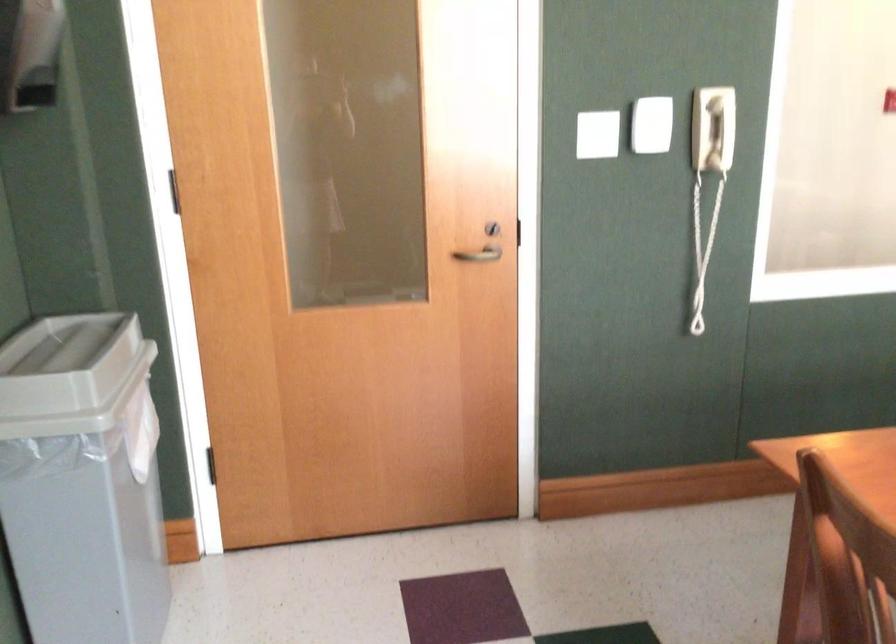
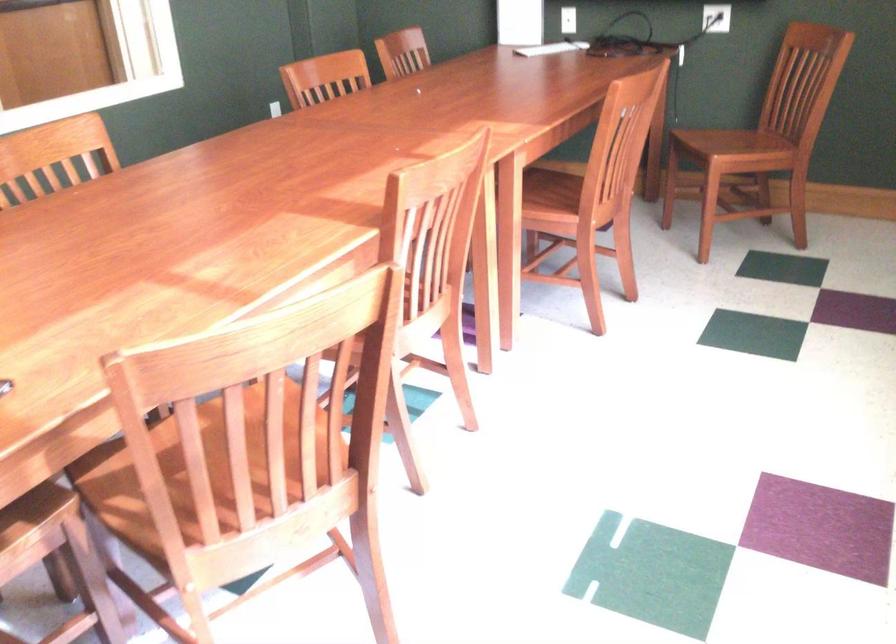
Question: How did the camera likely rotate?

Choices:
 (A) Left
 (B) Right
 (C) Up
 (D) Down

Answer: (B)